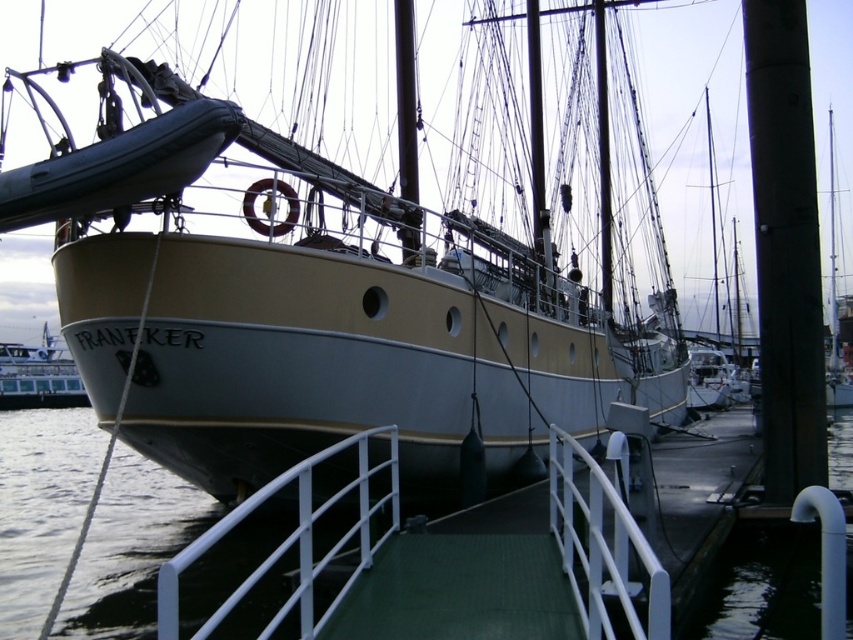
You are a dock worker checking the safety of the ship FRANEKER. You notice the white matte rail at center and the white glossy ferry at lower left. Which object is located above the other?

The white matte rail at center is positioned over the white glossy ferry at lower left, meaning it is above it.

Looking at this image, you are standing on the dock and want to board the FRANEKER ship. There is a white matte rail at center located at point (602, 547). Can you walk straight from your current position to reach the ship without obstacles?

Yes, the white matte rail at center is located at point (602, 547), so walking straight from your current position on the dock towards that point will lead you directly to the ship without encountering any obstacles.

You are standing on the dock next to the FRANEKER ship. You want to know where the smooth gray water at center is positioned relative to the ship. Can you determine its exact coordinates?

The smooth gray water at center is located at point coordinates of (39, 506).